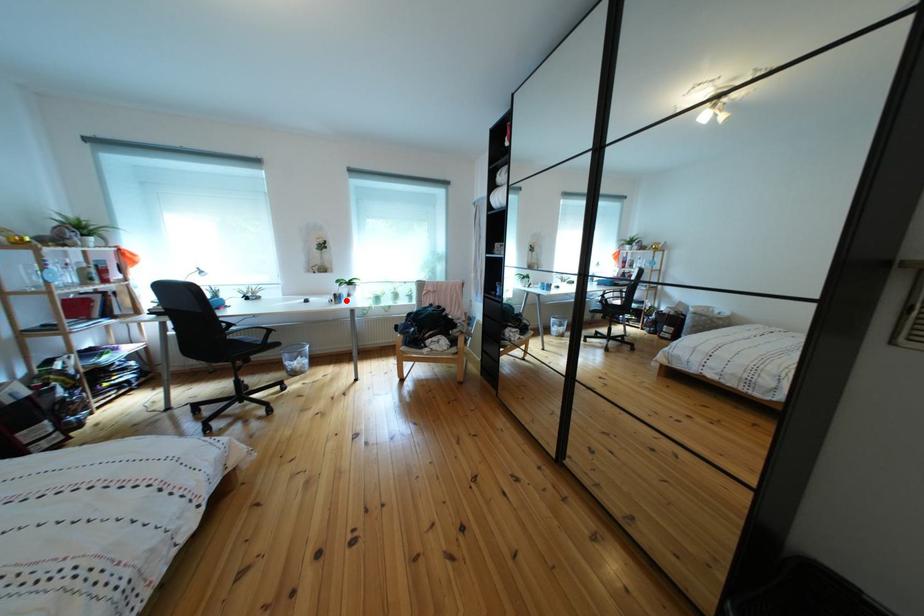
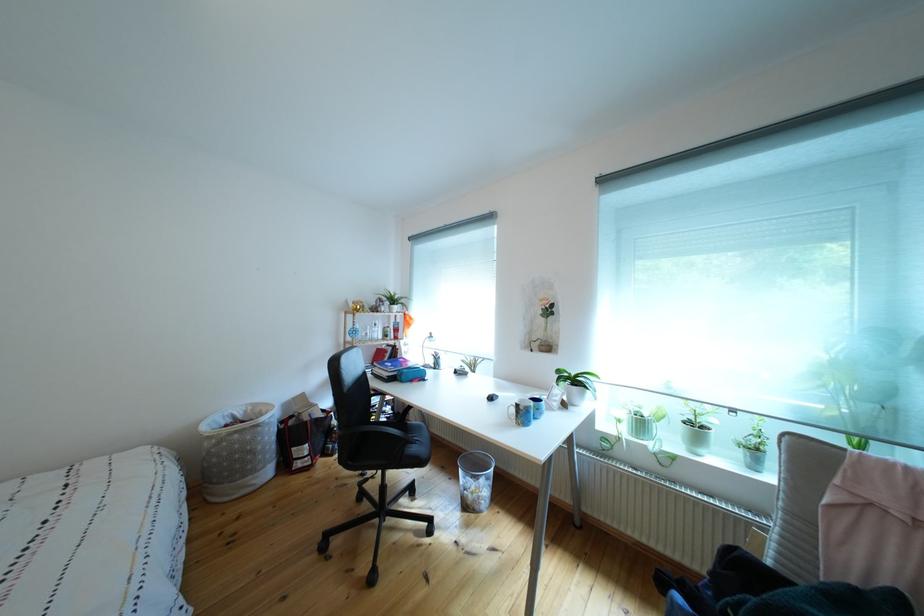
Question: I am providing you with two images of the same scene from different viewpoints. In image1, a red point is highlighted. Considering the same 3D point in image2, which of the following is correct?

Choices:
 (A) It is closer
 (B) It is farther

Answer: (B)